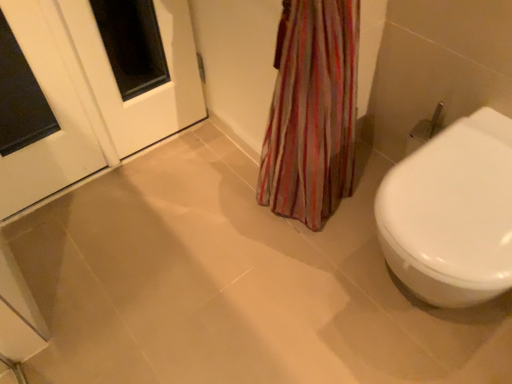
The height and width of the screenshot is (384, 512). What do you see at coordinates (56, 118) in the screenshot?
I see `white glossy door at upper left` at bounding box center [56, 118].

What is the approximate width of white glossy bidet at right?

white glossy bidet at right is 23.02 inches in width.

Where is `white glossy door at upper left`? This screenshot has height=384, width=512. white glossy door at upper left is located at coordinates (56, 118).

Would you consider white glossy door at upper left to be distant from white glossy door at upper left?

That's not correct — white glossy door at upper left is a little close to white glossy door at upper left.

Is white glossy door at upper left situated inside white glossy door at upper left or outside?

white glossy door at upper left is not enclosed by white glossy door at upper left.

Consider the image. Is white glossy door at upper left at the left side of white glossy door at upper left?

Incorrect, white glossy door at upper left is not on the left side of white glossy door at upper left.

Is white glossy door at upper left thinner than white glossy door at upper left?

Incorrect, the width of white glossy door at upper left is not less than that of white glossy door at upper left.

In terms of size, does white glossy bidet at right appear bigger or smaller than white glossy door at upper left?

In the image, white glossy bidet at right appears to be larger than white glossy door at upper left.

Is white glossy bidet at right positioned with its back to white glossy door at upper left?

No, white glossy bidet at right's orientation is not away from white glossy door at upper left.

In the scene shown: Considering the sizes of white glossy bidet at right and white glossy door at upper left in the image, is white glossy bidet at right taller or shorter than white glossy door at upper left?

white glossy bidet at right is shorter than white glossy door at upper left.

Does white glossy door at upper left touch white glossy door at upper left?

No.

Can you confirm if white glossy door at upper left is taller than white glossy door at upper left?

Indeed, white glossy door at upper left has a greater height compared to white glossy door at upper left.

You are a GUI agent. You are given a task and a screenshot of the screen. Output one action in this format:
    pyautogui.click(x=<x>, y=<y>)
    Task: Click on the screen door above the white glossy door at upper left (from the image's perspective)
    
    Given the screenshot: What is the action you would take?
    pyautogui.click(x=147, y=91)

From the picture: Between white glossy door at upper left and white glossy door at upper left, which one appears on the left side from the viewer's perspective?

white glossy door at upper left is more to the left.

Does white glossy door at upper left appear on the left side of white glossy bidet at right?

Correct, you'll find white glossy door at upper left to the left of white glossy bidet at right.

From a real-world perspective, between white glossy door at upper left and white glossy bidet at right, who is vertically higher?

white glossy door at upper left.

Does point (113, 126) come farther from viewer compared to point (442, 291)?

Yes.

Is white glossy door at upper left closer to camera compared to white glossy bidet at right?

No, it is not.

Is white glossy door at upper left oriented towards white glossy bidet at right?

No, white glossy door at upper left is not aimed at white glossy bidet at right.

Is white glossy door at upper left shorter than white glossy bidet at right?

Incorrect, the height of white glossy door at upper left does not fall short of that of white glossy bidet at right.

Which object is closer to the camera taking this photo, white glossy door at upper left or white glossy bidet at right?

white glossy bidet at right is in front.

In terms of height, does white glossy bidet at right look taller or shorter compared to white glossy door at upper left?

Considering their sizes, white glossy bidet at right has less height than white glossy door at upper left.

Is white glossy bidet at right to the right of white glossy door at upper left from the viewer's perspective?

Yes.

How much distance is there between white glossy bidet at right and white glossy door at upper left?

39.33 inches.

You are a GUI agent. You are given a task and a screenshot of the screen. Output one action in this format:
    pyautogui.click(x=<x>, y=<y>)
    Task: Click on the bidet below the white glossy door at upper left (from the image's perspective)
    This screenshot has height=384, width=512.
    Given the screenshot: What is the action you would take?
    pyautogui.click(x=452, y=213)

Where is `door that is in front of the white glossy door at upper left`? This screenshot has width=512, height=384. door that is in front of the white glossy door at upper left is located at coordinates (56, 118).

The image size is (512, 384). What are the coordinates of `bidet lying below the white glossy door at upper left (from the image's perspective)` in the screenshot? It's located at (452, 213).

Considering their positions, is white glossy door at upper left positioned closer to white glossy bidet at right than white glossy door at upper left?

Based on the image, white glossy door at upper left appears to be nearer to white glossy bidet at right.

From the image, which object appears to be nearer to white glossy door at upper left, white glossy door at upper left or white glossy bidet at right?

Based on the image, white glossy door at upper left appears to be nearer to white glossy door at upper left.

Looking at the image, which one is located closer to white glossy bidet at right, white glossy door at upper left or white glossy door at upper left?

white glossy door at upper left.

Considering their positions, is white glossy bidet at right positioned further to white glossy door at upper left than white glossy door at upper left?

The object further to white glossy door at upper left is white glossy bidet at right.

Considering their positions, is white glossy bidet at right positioned further to white glossy door at upper left than white glossy door at upper left?

white glossy bidet at right.

Looking at the image, which one is located closer to white glossy door at upper left, white glossy door at upper left or white glossy bidet at right?

white glossy door at upper left.

This screenshot has height=384, width=512. I want to click on screen door located between white glossy door at upper left and white glossy bidet at right in the left-right direction, so click(x=147, y=91).